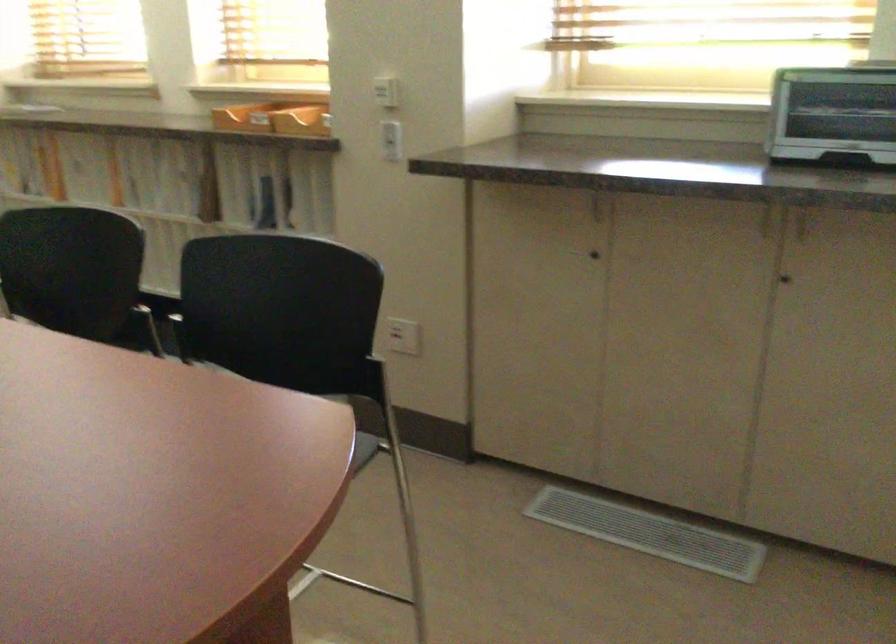
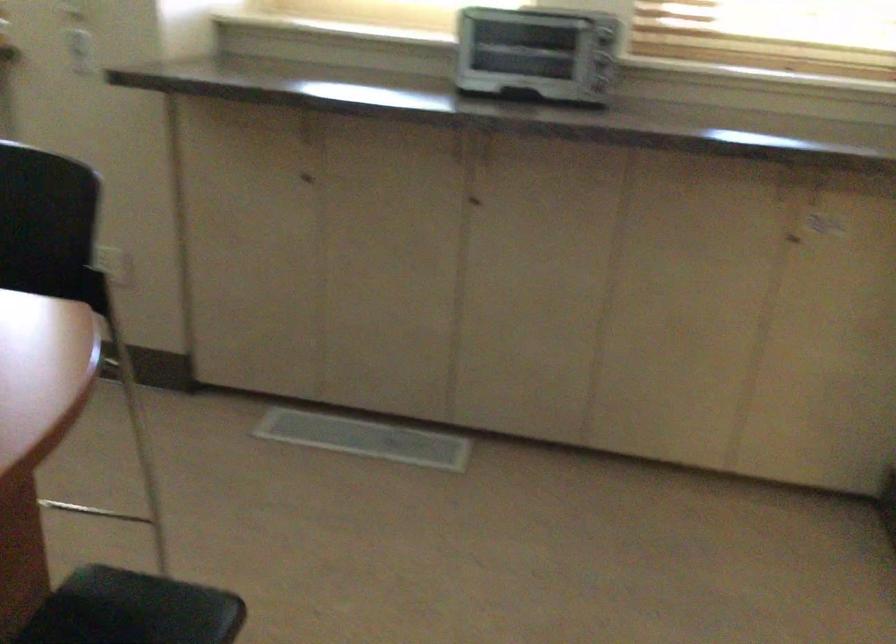
Which direction would the cameraman need to move to produce the second image?

The cameraman moved toward left, backward.